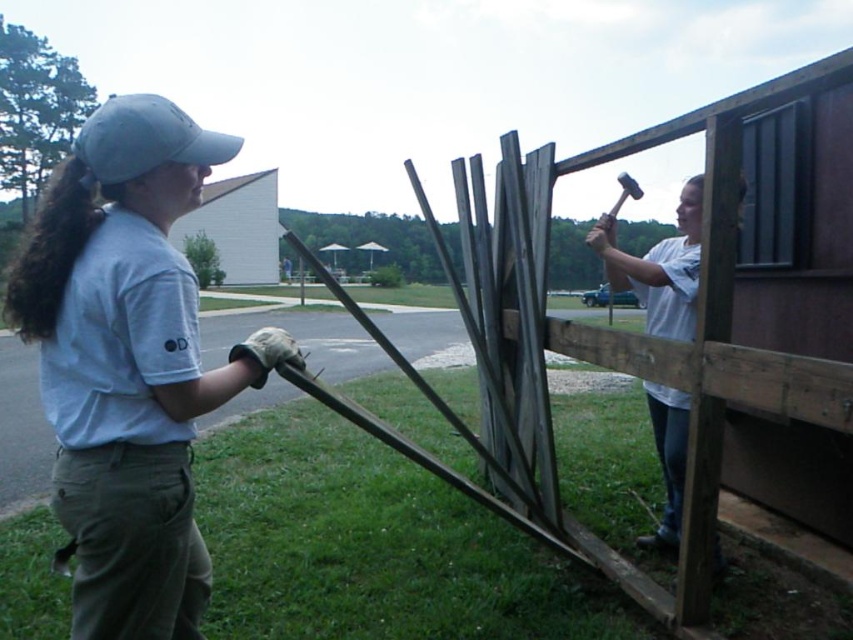
Based on the photo, is light gray cotton cap at upper left above gray fabric baseball cap at upper left?

Incorrect, light gray cotton cap at upper left is not positioned above gray fabric baseball cap at upper left.

Which of these two, light gray cotton cap at upper left or gray fabric baseball cap at upper left, stands shorter?

light gray cotton cap at upper left is shorter.

Who is more forward, (x=45, y=310) or (x=126, y=124)?

Positioned in front is point (x=126, y=124).

You are a GUI agent. You are given a task and a screenshot of the screen. Output one action in this format:
    pyautogui.click(x=<x>, y=<y>)
    Task: Click on the light gray cotton cap at upper left
    
    Given the screenshot: What is the action you would take?
    pos(128,364)

Can you confirm if light gray cotton cap at upper left is wider than white matte hammer at upper right?

Indeed, light gray cotton cap at upper left has a greater width compared to white matte hammer at upper right.

The height and width of the screenshot is (640, 853). What do you see at coordinates (128, 364) in the screenshot? I see `light gray cotton cap at upper left` at bounding box center [128, 364].

Find the location of a particular element. The width and height of the screenshot is (853, 640). light gray cotton cap at upper left is located at coordinates (128, 364).

Is white matte hammer at upper right below gray fabric baseball cap at upper left?

Indeed, white matte hammer at upper right is positioned under gray fabric baseball cap at upper left.

Who is more forward, (x=691, y=195) or (x=184, y=152)?

Positioned in front is point (x=184, y=152).

Identify the location of white matte hammer at upper right. pos(660,268).